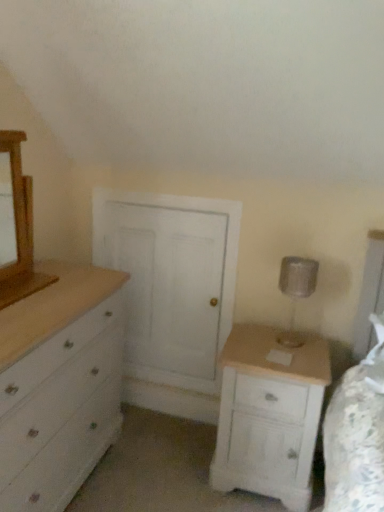
Question: Is wooden medicine cabinet at left further to the viewer compared to white painted wood chest of drawers at left?

Choices:
 (A) no
 (B) yes

Answer: (B)

Question: From a real-world perspective, is wooden medicine cabinet at left below white painted wood chest of drawers at left?

Choices:
 (A) yes
 (B) no

Answer: (B)

Question: Is wooden medicine cabinet at left placed right next to white painted wood chest of drawers at left?

Choices:
 (A) yes
 (B) no

Answer: (B)

Question: Considering the relative sizes of wooden medicine cabinet at left and white painted wood chest of drawers at left in the image provided, is wooden medicine cabinet at left smaller than white painted wood chest of drawers at left?

Choices:
 (A) yes
 (B) no

Answer: (A)

Question: Is wooden medicine cabinet at left taller than white painted wood chest of drawers at left?

Choices:
 (A) no
 (B) yes

Answer: (A)

Question: Does wooden medicine cabinet at left contain white painted wood chest of drawers at left?

Choices:
 (A) no
 (B) yes

Answer: (A)

Question: From a real-world perspective, does silver metallic table lamp at right stand above wooden medicine cabinet at left?

Choices:
 (A) yes
 (B) no

Answer: (B)

Question: Does silver metallic table lamp at right turn towards wooden medicine cabinet at left?

Choices:
 (A) yes
 (B) no

Answer: (B)

Question: From the image's perspective, does silver metallic table lamp at right appear higher than wooden medicine cabinet at left?

Choices:
 (A) yes
 (B) no

Answer: (B)

Question: Does silver metallic table lamp at right appear on the right side of wooden medicine cabinet at left?

Choices:
 (A) no
 (B) yes

Answer: (B)

Question: Is silver metallic table lamp at right turned away from wooden medicine cabinet at left?

Choices:
 (A) no
 (B) yes

Answer: (A)

Question: Considering the relative sizes of silver metallic table lamp at right and wooden medicine cabinet at left in the image provided, is silver metallic table lamp at right bigger than wooden medicine cabinet at left?

Choices:
 (A) yes
 (B) no

Answer: (B)

Question: Does white wood nightstand at lower right appear on the left side of silver metallic table lamp at right?

Choices:
 (A) yes
 (B) no

Answer: (A)